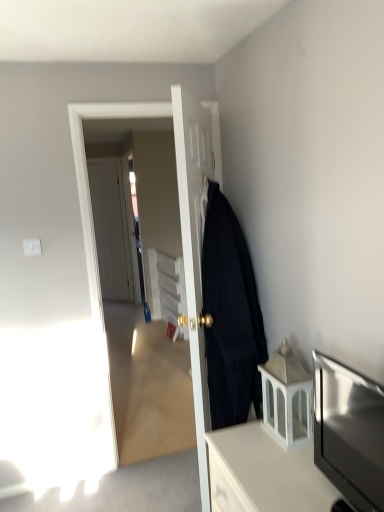
Question: Does matte black coat at center, which appears as the 2th door when viewed from the left, have a greater height compared to white glass lantern at lower right, which is the second cabinetry from bottom to top?

Choices:
 (A) yes
 (B) no

Answer: (A)

Question: Considering the relative sizes of matte black coat at center, which appears as the 2th door when viewed from the left, and white glass lantern at lower right, the 1th cabinetry when ordered from top to bottom, in the image provided, is matte black coat at center, which appears as the 2th door when viewed from the left, wider than white glass lantern at lower right, the 1th cabinetry when ordered from top to bottom,?

Choices:
 (A) yes
 (B) no

Answer: (A)

Question: Considering the relative sizes of matte black coat at center, acting as the 1th door starting from the right, and white glass lantern at lower right, which is the second cabinetry from bottom to top, in the image provided, is matte black coat at center, acting as the 1th door starting from the right, bigger than white glass lantern at lower right, which is the second cabinetry from bottom to top,?

Choices:
 (A) yes
 (B) no

Answer: (A)

Question: From the image's perspective, is matte black coat at center, acting as the 1th door starting from the right, located above white glass lantern at lower right, which is the second cabinetry from bottom to top?

Choices:
 (A) yes
 (B) no

Answer: (A)

Question: Can white glass lantern at lower right, which is the second cabinetry from bottom to top, be found inside matte black coat at center, the second door positioned from the back?

Choices:
 (A) no
 (B) yes

Answer: (A)

Question: Looking at the image, does white matte door at center, the 2th door positioned from the right, seem bigger or smaller compared to matte black coat at center, which appears as the 2th door when viewed from the left?

Choices:
 (A) small
 (B) big

Answer: (A)

Question: From the image's perspective, relative to matte black coat at center, acting as the 1th door starting from the right, is white matte door at center, the 2th door positioned from the right, above or below?

Choices:
 (A) above
 (B) below

Answer: (A)

Question: In terms of width, does white matte door at center, which is counted as the first door, starting from the left, look wider or thinner when compared to matte black coat at center, which appears as the 2th door when viewed from the left?

Choices:
 (A) wide
 (B) thin

Answer: (B)

Question: Is white matte door at center, which is counted as the first door, starting from the left, taller or shorter than matte black coat at center, which appears as the 2th door when viewed from the left?

Choices:
 (A) tall
 (B) short

Answer: (B)

Question: Relative to matte black tv at lower right, is black woolen coat at right in front or behind?

Choices:
 (A) behind
 (B) front

Answer: (A)

Question: Considering the positions of point (210, 241) and point (375, 449), is point (210, 241) closer or farther from the camera than point (375, 449)?

Choices:
 (A) farther
 (B) closer

Answer: (A)

Question: In terms of width, does black woolen coat at right look wider or thinner when compared to matte black tv at lower right?

Choices:
 (A) wide
 (B) thin

Answer: (A)

Question: From the image's perspective, is black woolen coat at right above or below matte black tv at lower right?

Choices:
 (A) above
 (B) below

Answer: (A)

Question: Would you say transparent glass door at center is to the left or to the right of white matte door at center, positioned as the first door in back-to-front order, in the picture?

Choices:
 (A) left
 (B) right

Answer: (B)

Question: Is transparent glass door at center situated inside white matte door at center, the 2th door positioned from the right, or outside?

Choices:
 (A) inside
 (B) outside

Answer: (B)